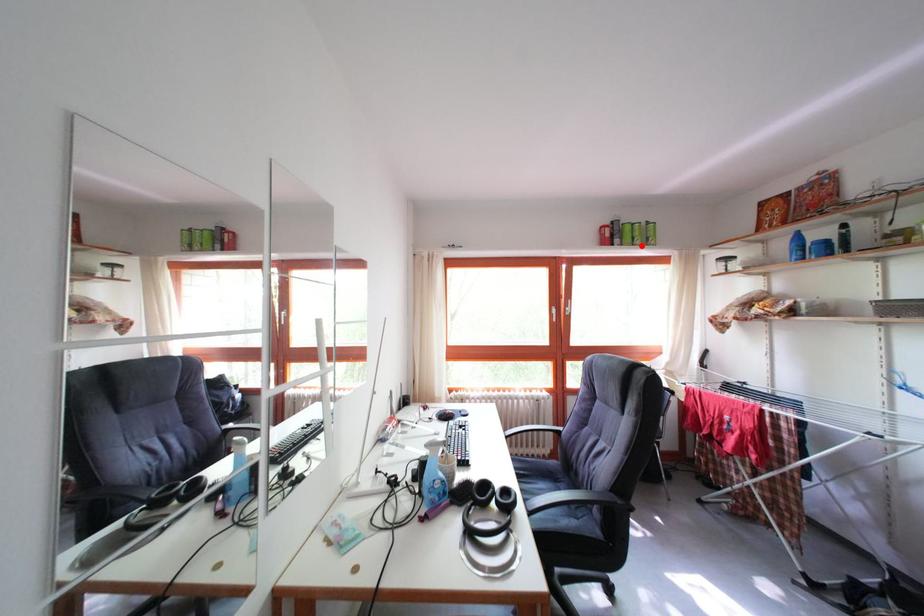
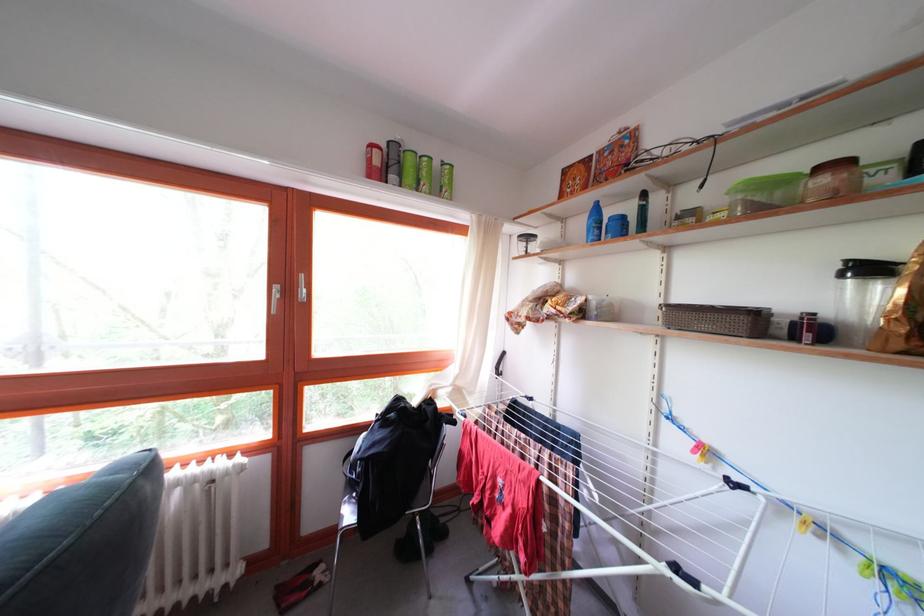
Locate, in the second image, the point that corresponds to the highlighted location in the first image.

(428, 187)